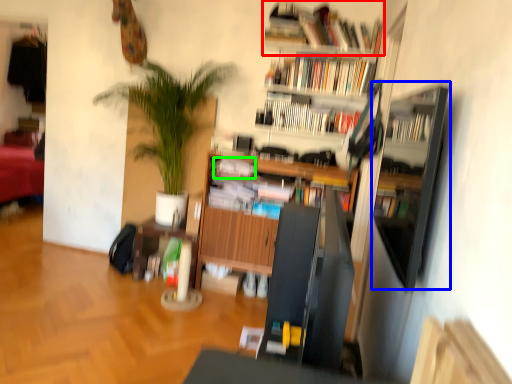
Question: Which object is the farthest from book (highlighted by a red box)? Choose among these: shelf (highlighted by a blue box) or book (highlighted by a green box).

Choices:
 (A) shelf
 (B) book

Answer: (A)